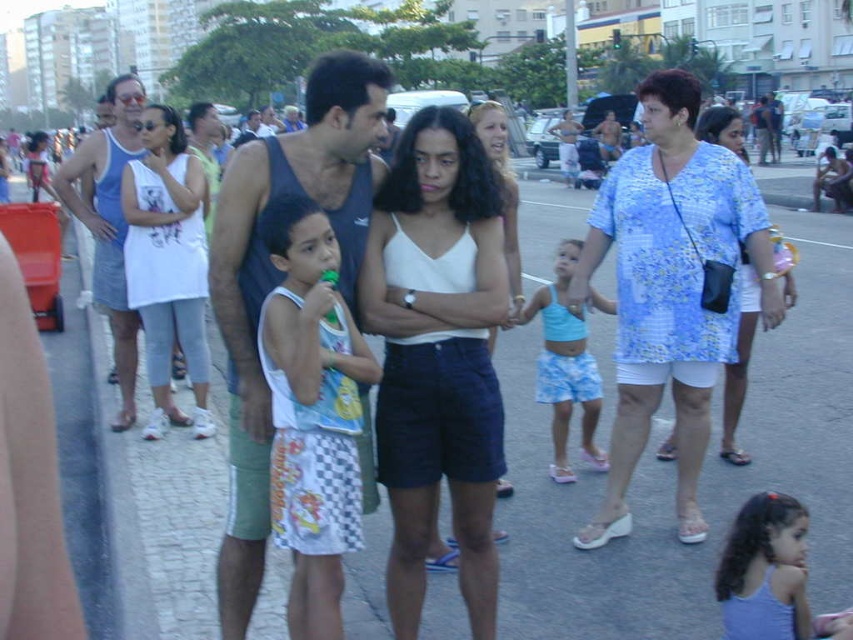
From the picture: You are standing at the center of the paved area in the scene. You need to locate the light purple fabric dress at lower right. Which direction should you turn to face it?

The light purple fabric dress at lower right is located at point (x=766, y=572), which is in the lower right direction from your current position at the center. Turn to face the lower right direction to locate it.

Based on the photo, in the scene, there is a young boy wearing a white tank top with a graphic design and checkered shorts, a man in a dark sleeveless shirt and green shorts, and a woman in a white sleeveless top and dark blue shorts. The point at coordinates (167, 262) is mentioned. Which clothing item does this point lie on?

The point at coordinates (167, 262) is on the white cotton tank top at left.

In the scene shown: In the scene described, there are two people wearing specific clothing items. The first person is wearing a light purple fabric dress at lower right, and the second is wearing light blue fabric shorts at center. From an observer standing at the front of the image, which clothing item is positioned lower in the image?

The light purple fabric dress at lower right is positioned below the light blue fabric shorts at center, so it is lower in the image.